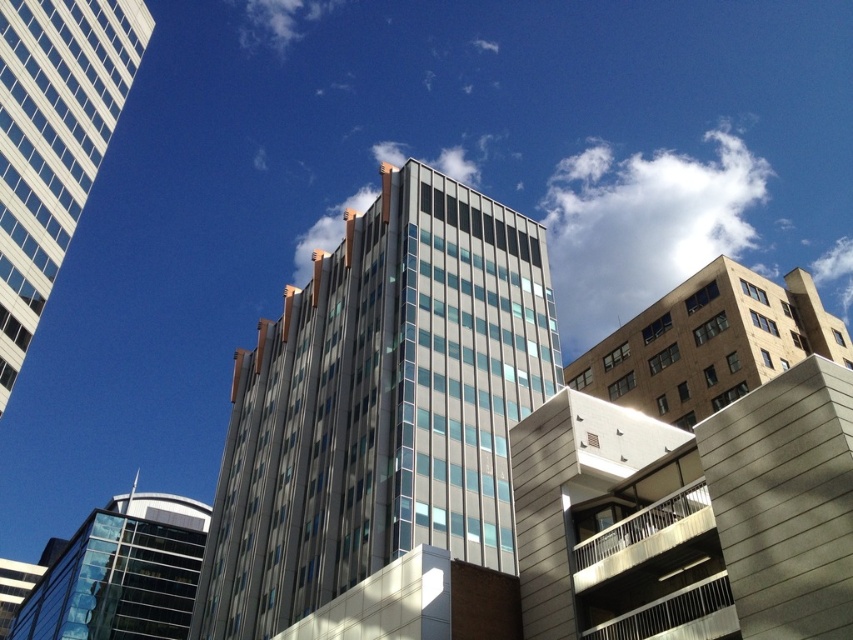
You are an architect analyzing the urban skyline. Which building, the metallic glass building at center or the white glass building at upper left, has a greater height?

The metallic glass building at center is much taller than the white glass building at upper left, so it has a greater height.

You are a drone operator tasked with flying a drone between the metallic glass building at center and the white glass building at upper left. The drone has a maximum flight distance of 30 meters. Based on the scene, can the drone safely complete this flight without exceeding its range?

The metallic glass building at center is 29.59 meters from the white glass building at upper left. Since the distance is within the drone operator maximum flight range of 30 meters, the drone can safely complete the flight between the metallic glass building at center and the white glass building at upper left.